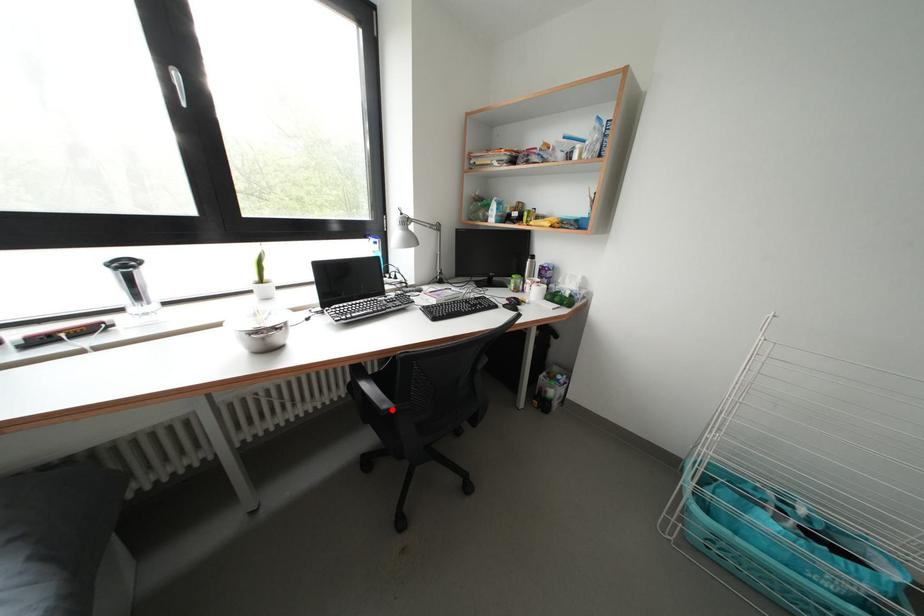
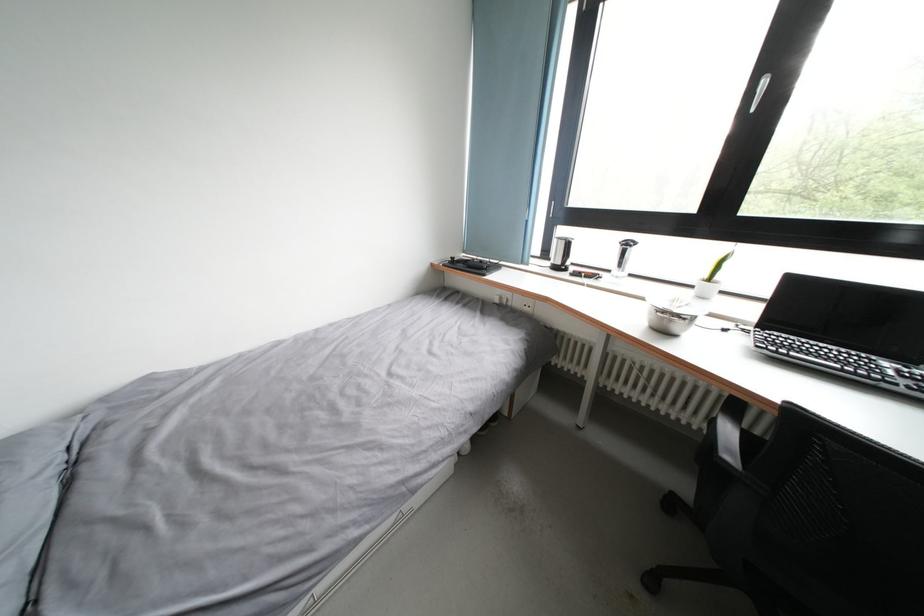
Question: I am providing you with two images of the same scene from different viewpoints. A red point is shown in image1. For the corresponding object point in image2, is it positioned nearer or farther from the camera?

Choices:
 (A) Nearer
 (B) Farther

Answer: (B)